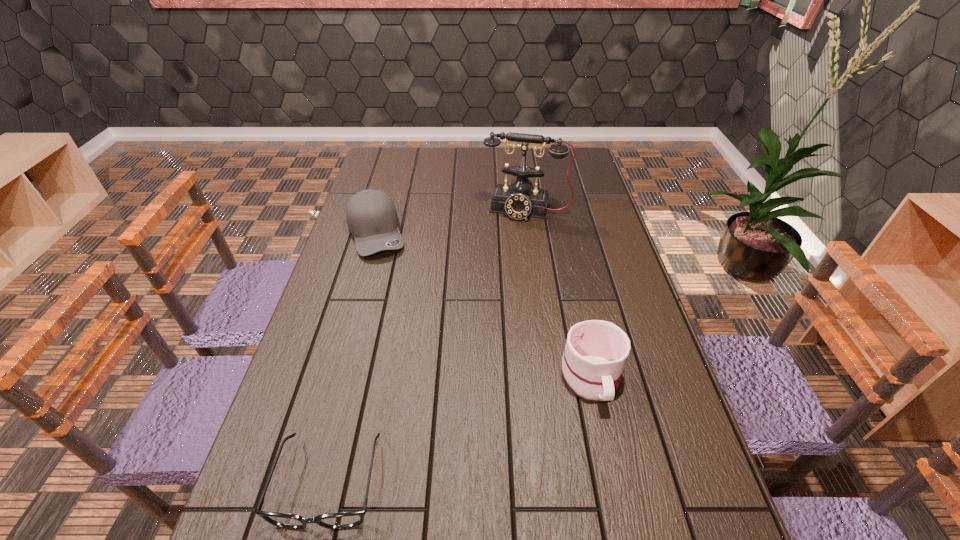
Where is `vacant space on the desktop that is between the spectacles and the third farthest object and is positioned on the front brim of the baseball cap`? The width and height of the screenshot is (960, 540). vacant space on the desktop that is between the spectacles and the third farthest object and is positioned on the front brim of the baseball cap is located at coordinates (452, 433).

This screenshot has height=540, width=960. I want to click on free spot on the desktop that is between the spectacles and the third farthest object and is positioned on the dial of the tallest object, so click(473, 424).